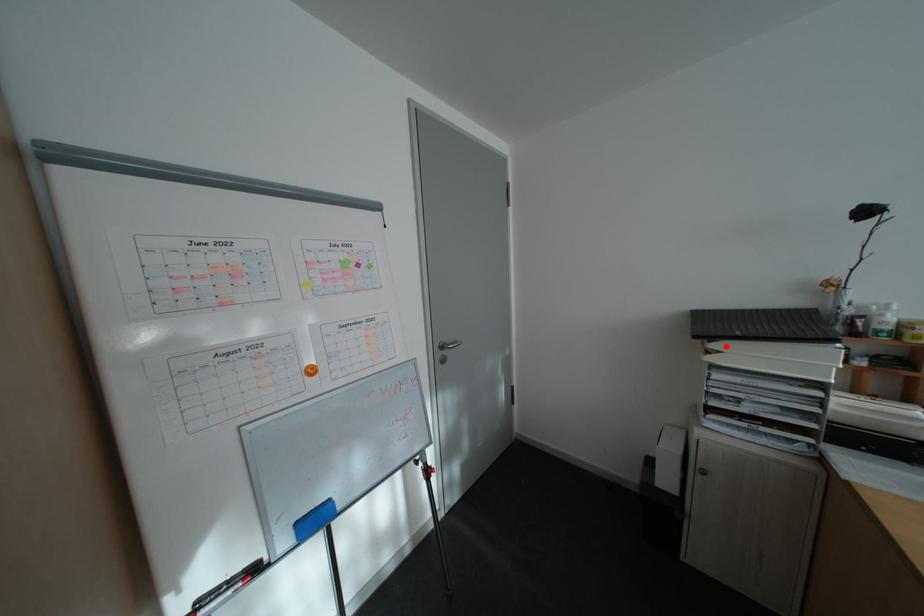
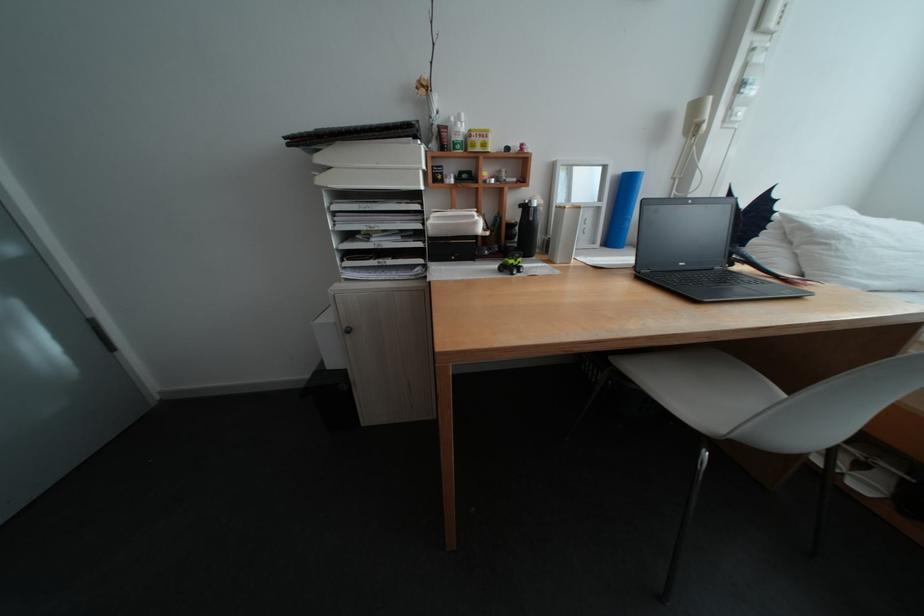
The point at the highlighted location is marked in the first image. Where is the corresponding point in the second image?

(333, 160)